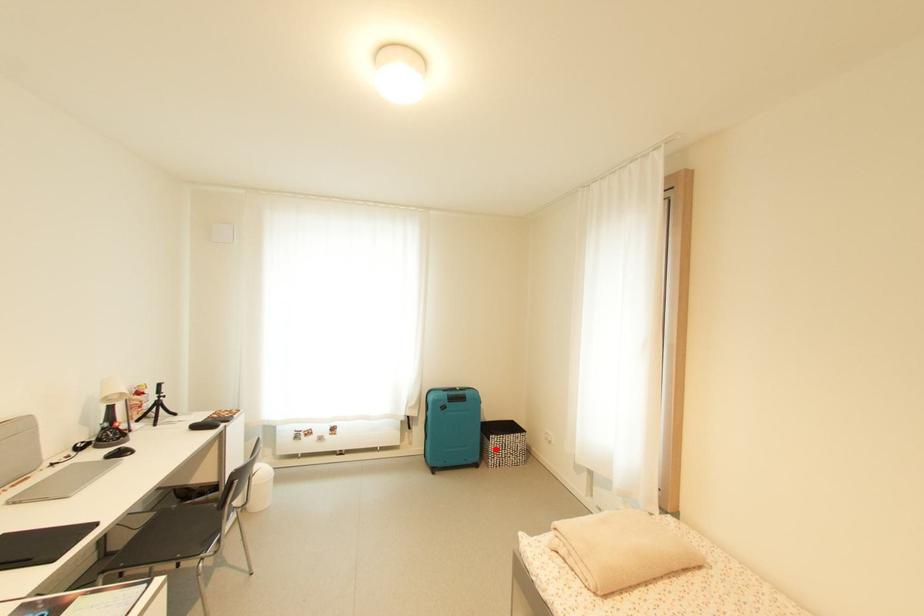
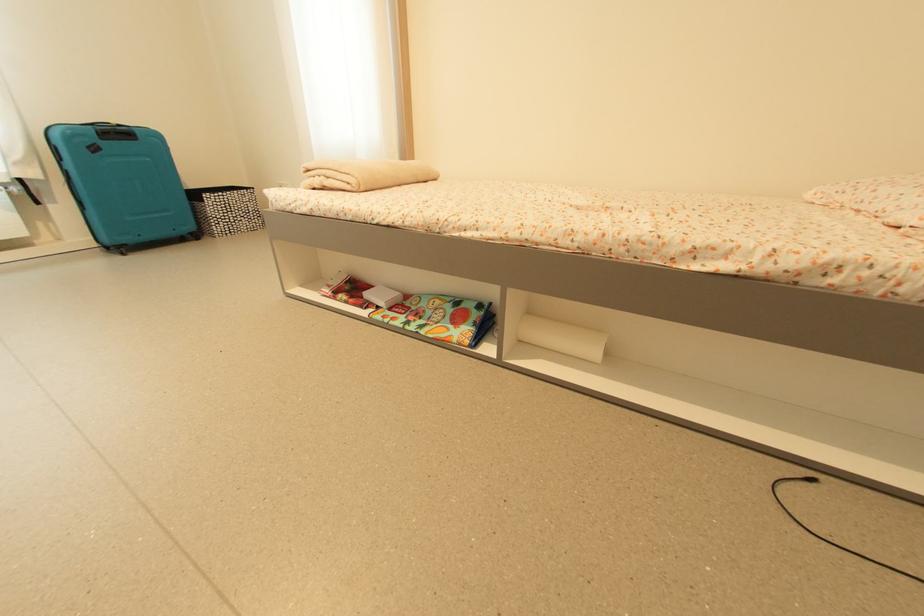
Find the pixel in the second image that matches the highlighted location in the first image.

(213, 212)